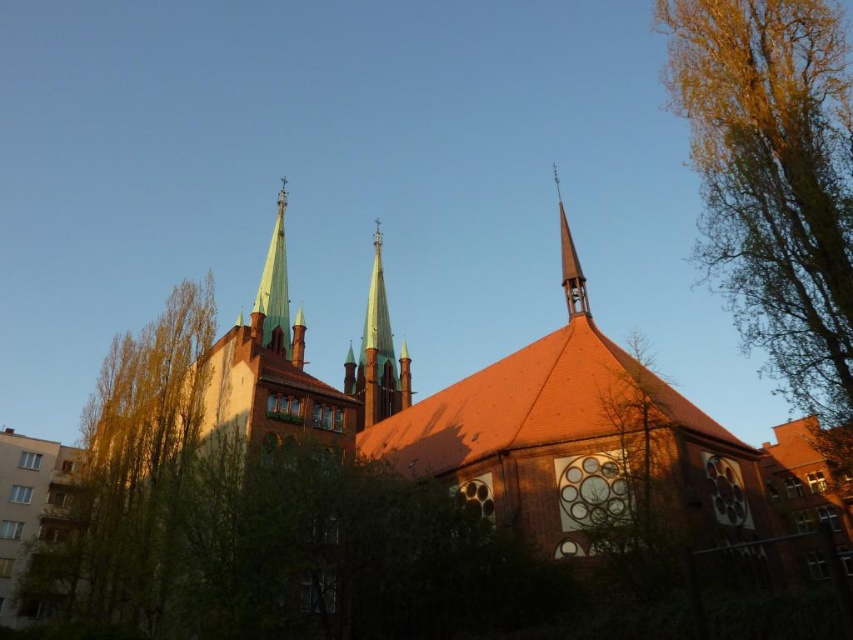
Question: Among these points, which one is nearest to the camera?

Choices:
 (A) (753, 316)
 (B) (152, 506)

Answer: (A)

Question: Is brown brick church at center positioned in front of green leafy tree at left?

Choices:
 (A) no
 (B) yes

Answer: (B)

Question: Is brown brick church at center positioned in front of green glass spire at upper left?

Choices:
 (A) no
 (B) yes

Answer: (B)

Question: Is brown brick church at center below golden-brown bark tree at right?

Choices:
 (A) no
 (B) yes

Answer: (B)

Question: Which point is farther from the camera taking this photo?

Choices:
 (A) (366, 324)
 (B) (281, 336)
 (C) (567, 266)
 (D) (221, 403)

Answer: (A)

Question: Which point is farther to the camera?

Choices:
 (A) (86, 634)
 (B) (577, 300)
 (C) (175, 342)

Answer: (C)